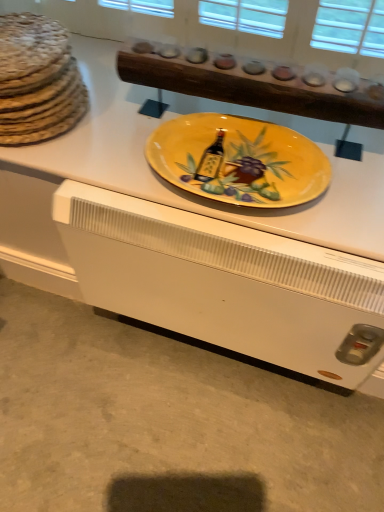
Identify the location of blank space situated above white matte heater at lower center (from a real-world perspective). (138, 415).